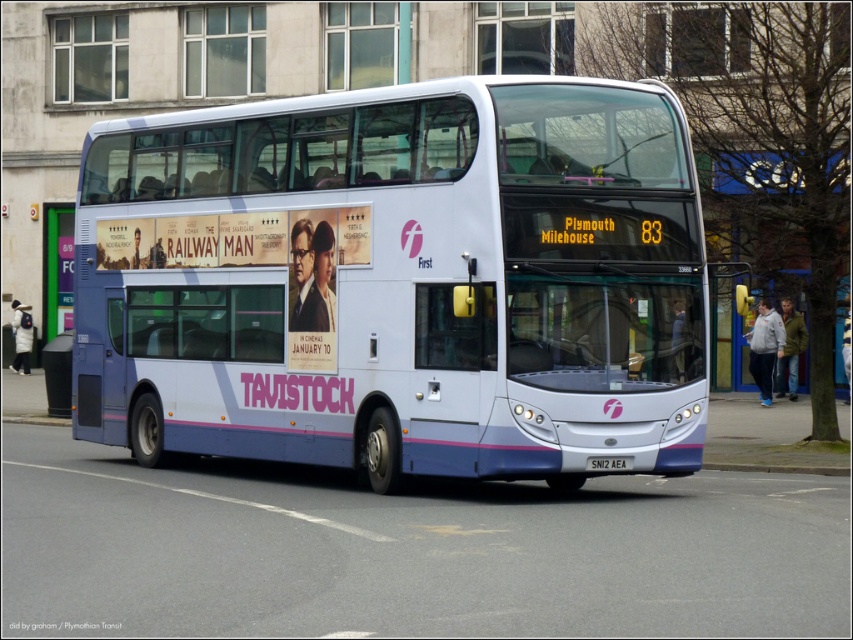
Question: Observing the image, what is the correct spatial positioning of white matte/decked bus at center in reference to black plastic license plate at bottom center?

Choices:
 (A) above
 (B) below

Answer: (A)

Question: Which point is closer to the camera?

Choices:
 (A) (496, 193)
 (B) (601, 458)

Answer: (A)

Question: Which point is farther from the camera taking this photo?

Choices:
 (A) (618, 456)
 (B) (601, 120)

Answer: (B)

Question: Does white matte/decked bus at center have a lesser width compared to black plastic license plate at bottom center?

Choices:
 (A) yes
 (B) no

Answer: (B)

Question: Which of the following is the farthest from the observer?

Choices:
 (A) black plastic license plate at bottom center
 (B) white matte/decked bus at center

Answer: (A)

Question: Is white matte/decked bus at center further to the viewer compared to black plastic license plate at bottom center?

Choices:
 (A) yes
 (B) no

Answer: (B)